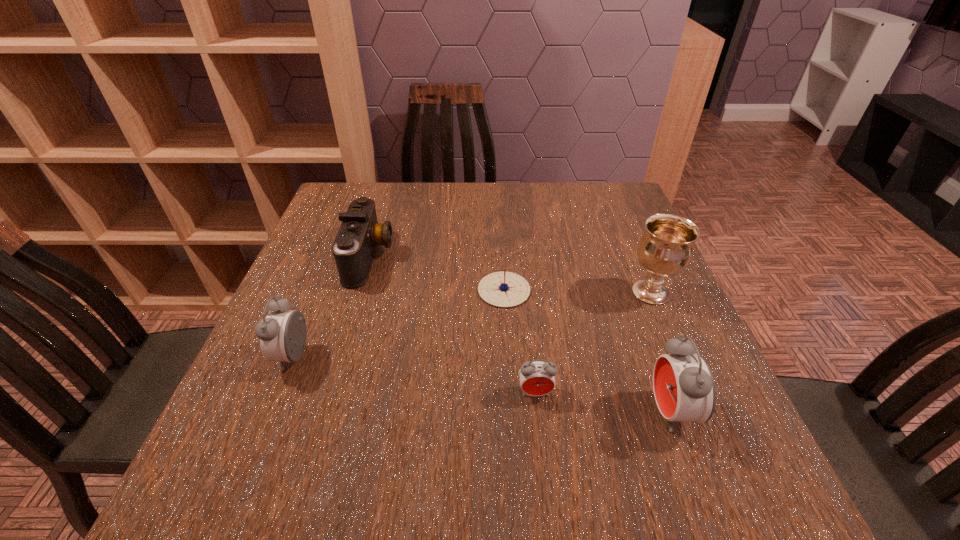
If equal spacing is the goal by inserting an additional alarm_clock among them, please point out a vacant space for this new alarm_clock. Please provide its 2D coordinates. Your answer should be formatted as a tuple, i.e. [(x, y)], where the tuple contains the x and y coordinates of a point satisfying the conditions above.

[(410, 375)]